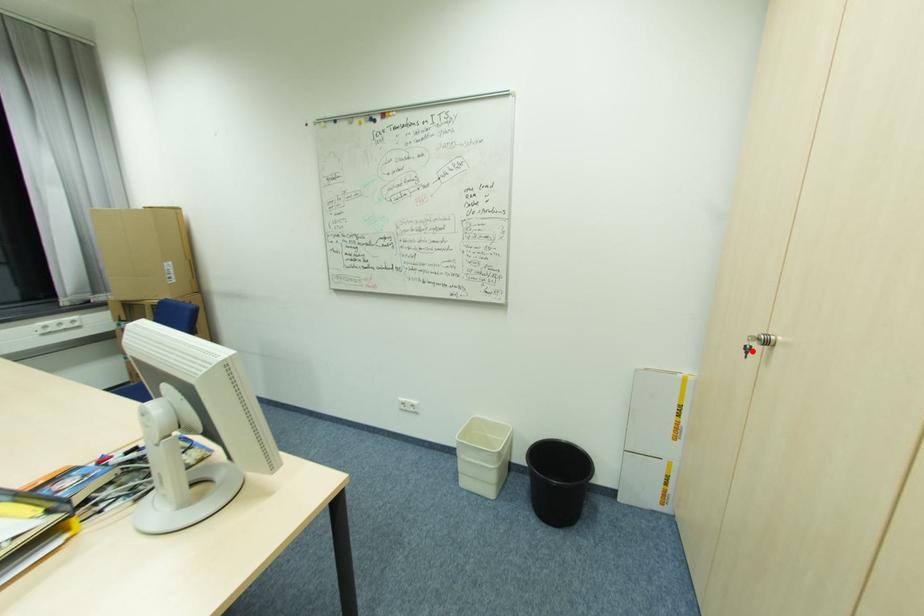
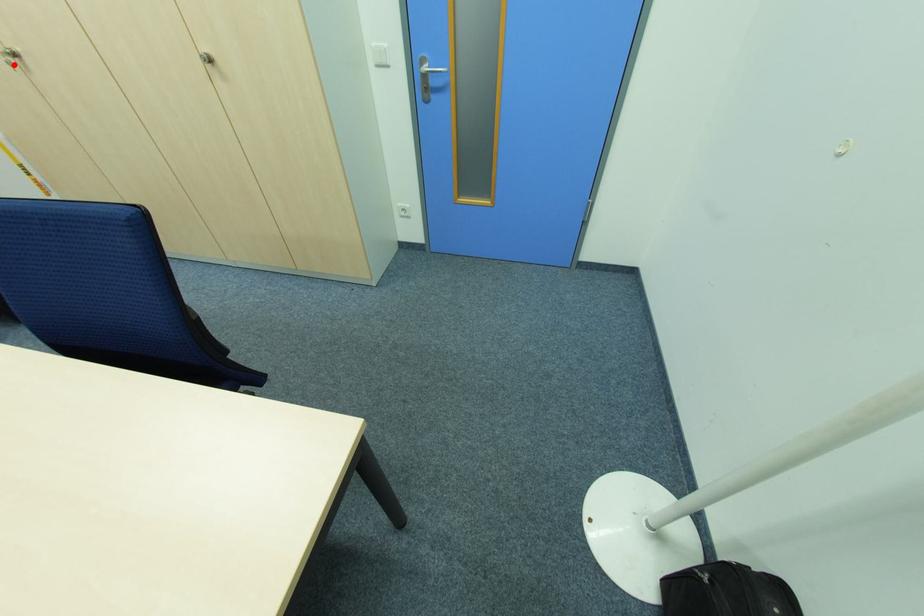
I am providing you with two images of the same scene from different viewpoints. A red point is marked on the first image and another point is marked on the second image. Do the highlighted points in image1 and image2 indicate the same real-world spot?

Yes